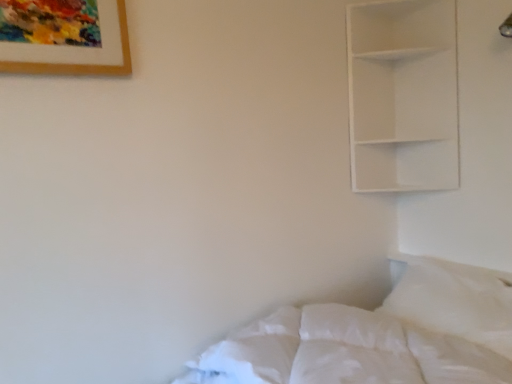
Question: Is white soft pillow at lower right to the left or to the right of white soft bed at lower right in the image?

Choices:
 (A) left
 (B) right

Answer: (B)

Question: In terms of height, does white soft pillow at lower right look taller or shorter compared to white soft bed at lower right?

Choices:
 (A) short
 (B) tall

Answer: (B)

Question: Estimate the real-world distances between objects in this image. Which object is closer to the white soft pillow at lower right?

Choices:
 (A) wooden framed artwork at upper left
 (B) white matte shelf at upper right
 (C) white soft bed at lower right

Answer: (C)

Question: Which is nearer to the wooden framed artwork at upper left?

Choices:
 (A) white soft pillow at lower right
 (B) white matte shelf at upper right
 (C) white soft bed at lower right

Answer: (C)